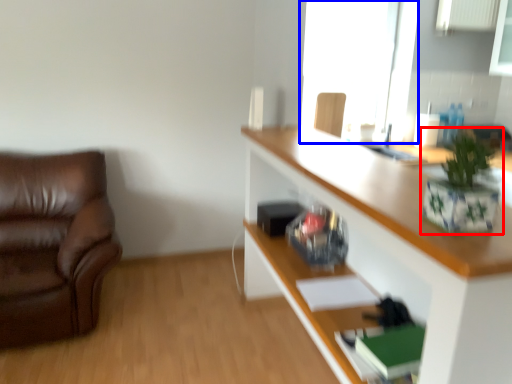
Question: Which object appears closest to the camera in this image, houseplant (highlighted by a red box) or window (highlighted by a blue box)?

Choices:
 (A) houseplant
 (B) window

Answer: (A)